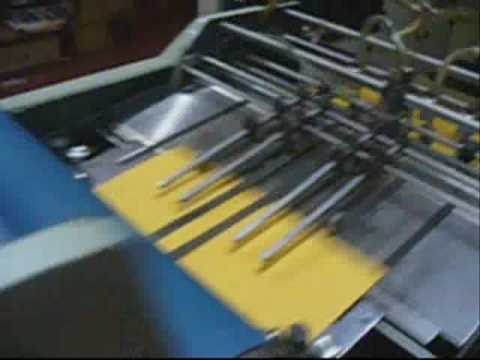
Locate an element on the screen. The height and width of the screenshot is (360, 480). rod is located at coordinates (436, 175).